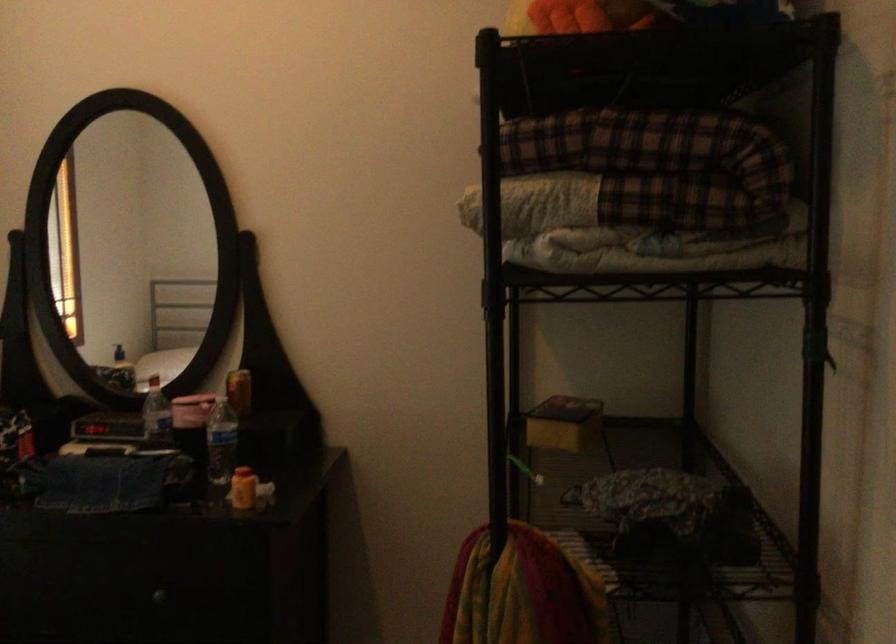
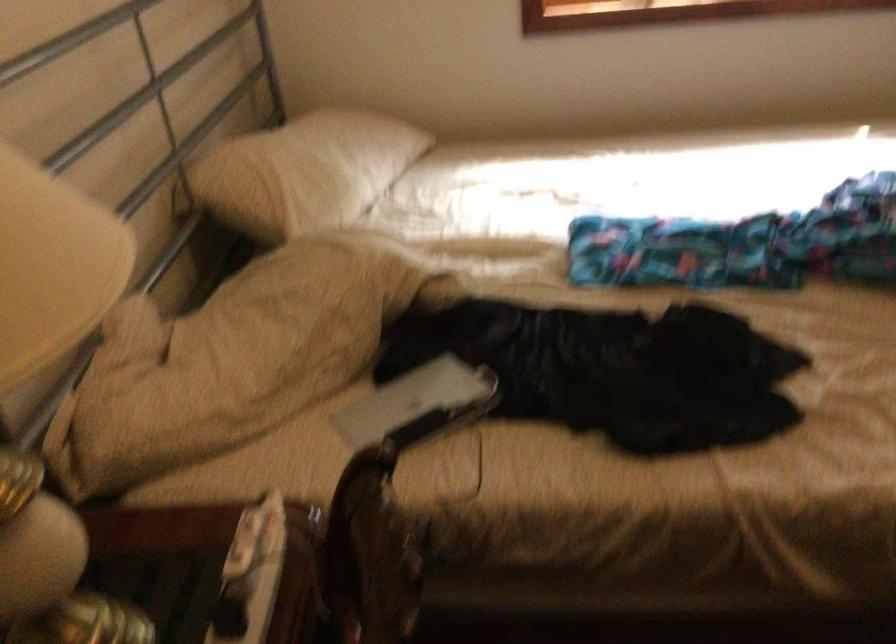
The first image is from the beginning of the video and the second image is from the end. How did the camera likely rotate when shooting the video?

The camera's rotation is toward left-down.